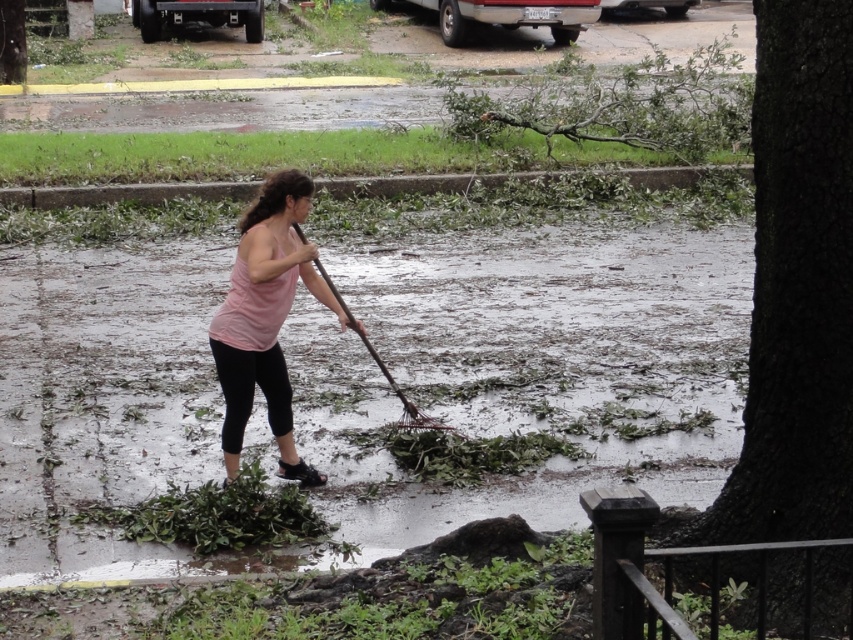
Does pink fabric tank top at center have a greater height compared to brown wooden rake at center?

Yes, pink fabric tank top at center is taller than brown wooden rake at center.

Who is positioned more to the right, pink fabric tank top at center or brown wooden rake at center?

brown wooden rake at center is more to the right.

Which is behind, point (213, 323) or point (323, 269)?

Point (323, 269)

The width and height of the screenshot is (853, 640). I want to click on pink fabric tank top at center, so click(265, 317).